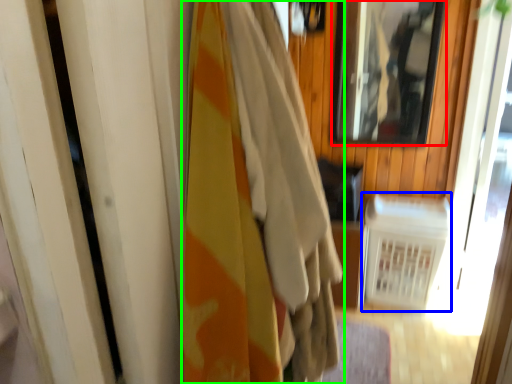
Question: Which is nearer to the mirror (highlighted by a red box)? radiator (highlighted by a blue box) or curtain (highlighted by a green box).

Choices:
 (A) radiator
 (B) curtain

Answer: (A)